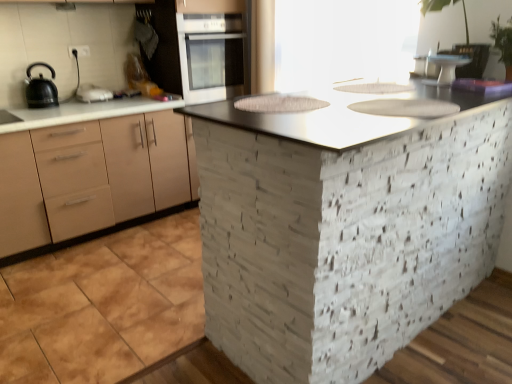
Question: From the image's perspective, would you say white glossy sink at upper center, the 1th sink in the back-to-front sequence, is shown under matte black kettle at left?

Choices:
 (A) no
 (B) yes

Answer: (B)

Question: Does white glossy sink at upper center, the 1th sink in the back-to-front sequence, have a lesser width compared to matte black kettle at left?

Choices:
 (A) no
 (B) yes

Answer: (A)

Question: Is matte black kettle at left at the back of white glossy sink at upper center, which ranks as the second sink in bottom-to-top order?

Choices:
 (A) yes
 (B) no

Answer: (B)

Question: Is white glossy sink at upper center, placed as the first sink when sorted from top to bottom, next to matte black kettle at left?

Choices:
 (A) yes
 (B) no

Answer: (B)

Question: Could you tell me if white glossy sink at upper center, placed as the first sink when sorted from top to bottom, is facing matte black kettle at left?

Choices:
 (A) yes
 (B) no

Answer: (B)

Question: Would you say white glossy sink at upper center, the second sink in the front-to-back sequence, is outside matte black kettle at left?

Choices:
 (A) no
 (B) yes

Answer: (B)

Question: Does white glossy cake stand at upper right appear on the left side of metallic gray countertop at center?

Choices:
 (A) yes
 (B) no

Answer: (B)

Question: Does white glossy cake stand at upper right lie in front of metallic gray countertop at center?

Choices:
 (A) no
 (B) yes

Answer: (A)

Question: From the image's perspective, is white glossy cake stand at upper right beneath metallic gray countertop at center?

Choices:
 (A) no
 (B) yes

Answer: (A)

Question: Is white glossy cake stand at upper right positioned behind metallic gray countertop at center?

Choices:
 (A) no
 (B) yes

Answer: (B)

Question: Is white glossy cake stand at upper right oriented towards metallic gray countertop at center?

Choices:
 (A) yes
 (B) no

Answer: (B)

Question: Is white glossy cake stand at upper right not within metallic gray countertop at center?

Choices:
 (A) no
 (B) yes

Answer: (B)

Question: Does transparent glass window screen at upper center have a greater height compared to white glossy oven at upper center?

Choices:
 (A) no
 (B) yes

Answer: (B)